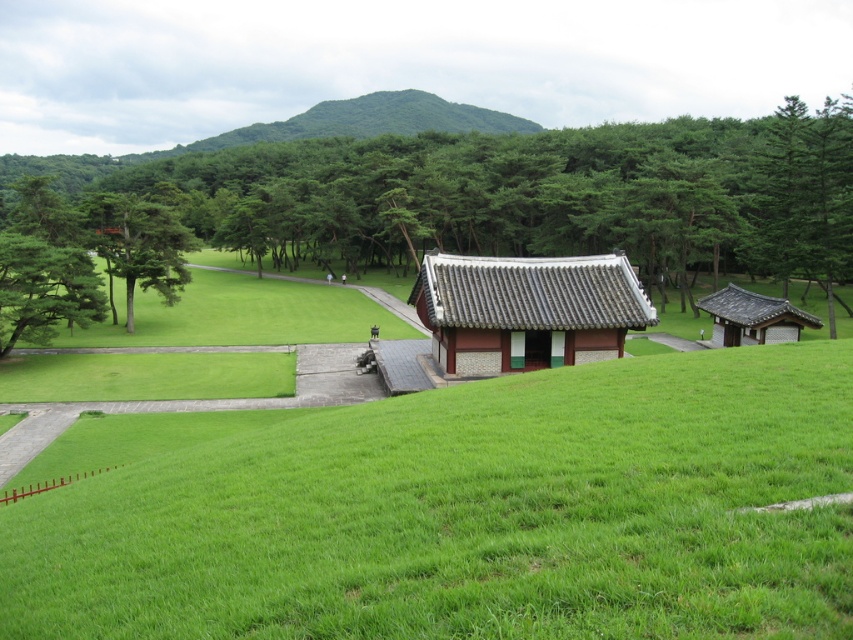
You are standing at the entrance of the traditional East Asian building and see two points marked on a map. The first point is at coordinates point [775,244] and the second is at point [18,244]. Which point is closer to you?

Point [18,244] is closer to you because it is positioned closer to the entrance of the traditional East Asian building compared to point [775,244].

You are standing at the center of the image and want to find the green textured tree at upper right. Which direction should you look to locate it?

The green textured tree at upper right is located at point (802, 196), so you should look towards the upper right direction to find it.